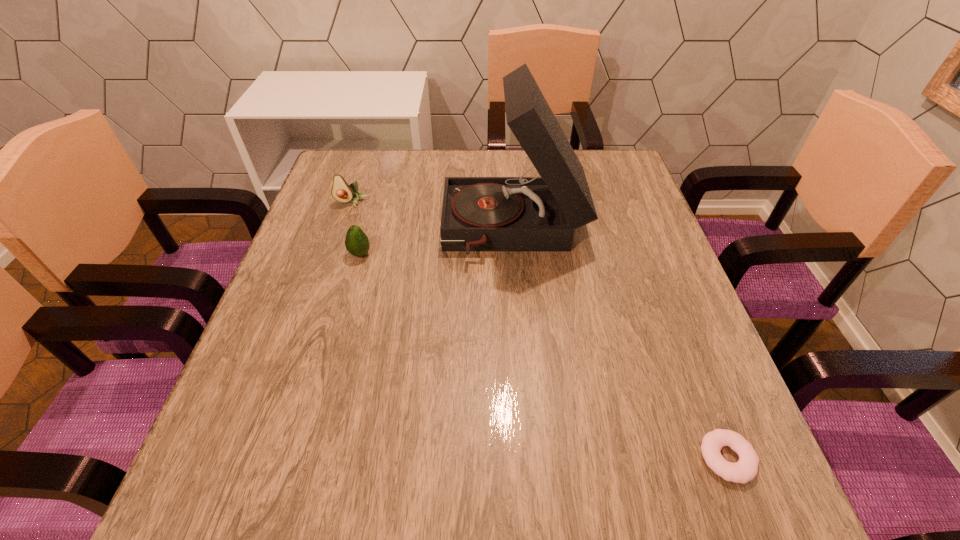
Locate an element on the screen. free space at the far left corner of the desktop is located at coordinates (372, 151).

Find the location of a particular element. The width and height of the screenshot is (960, 540). vacant region at the near left corner of the desktop is located at coordinates (275, 463).

Identify the location of blank space at the far right corner of the desktop. This screenshot has width=960, height=540. (611, 153).

Find the location of `vacant space in between the nearest object and the shorter avocado`. vacant space in between the nearest object and the shorter avocado is located at coordinates click(x=543, y=356).

Image resolution: width=960 pixels, height=540 pixels. In order to click on free space between the third object from left to right and the farther avocado in this screenshot , I will do `click(433, 217)`.

Locate an element on the screen. Image resolution: width=960 pixels, height=540 pixels. vacant space that is in between the rightmost object and the farther avocado is located at coordinates (540, 330).

Locate an element on the screen. Image resolution: width=960 pixels, height=540 pixels. free space between the shortest object and the farther avocado is located at coordinates (540, 330).

This screenshot has width=960, height=540. I want to click on free area in between the farther avocado and the shortest object, so click(540, 330).

Where is `free space between the second shortest object and the doughnut`? This screenshot has width=960, height=540. free space between the second shortest object and the doughnut is located at coordinates (543, 356).

Locate an element on the screen. Image resolution: width=960 pixels, height=540 pixels. free space between the nearest object and the farther avocado is located at coordinates (540, 330).